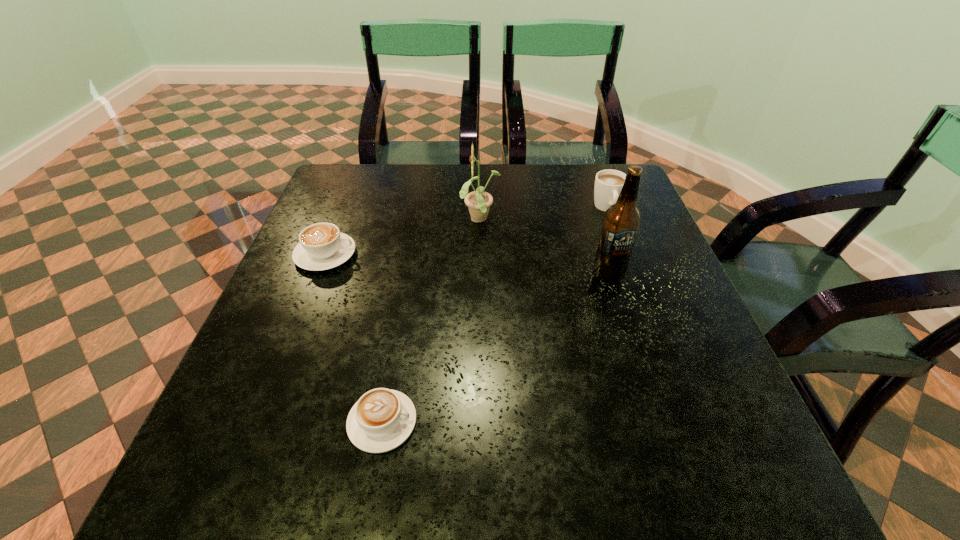
Identify the location of vacant point located on the front-facing side of the sunflower. This screenshot has width=960, height=540. (316, 220).

You are a GUI agent. You are given a task and a screenshot of the screen. Output one action in this format:
    pyautogui.click(x=<x>, y=<y>)
    Task: Click on the vacant region located on the front-facing side of the sunflower
    
    Given the screenshot: What is the action you would take?
    pyautogui.click(x=373, y=220)

This screenshot has width=960, height=540. What are the coordinates of `vacant space located 0.300m on the front-facing side of the sunflower` in the screenshot? It's located at (347, 220).

The width and height of the screenshot is (960, 540). Identify the location of free space located 0.200m with the handle on the side of the tallest cappuccino. (631, 271).

At what (x,y) coordinates should I click in order to perform the action: click on vacant space situated on the side of the leftmost object with the handle. Please return your answer as a coordinate pair (x, y). Looking at the image, I should click on (516, 254).

This screenshot has height=540, width=960. Identify the location of blank space located with the handle on the right side of the nearest cappuccino. (650, 422).

Find the location of a particular element. sunflower located at the far edge is located at coordinates (478, 202).

Find the location of `cappuccino that is at the far edge`. cappuccino that is at the far edge is located at coordinates tap(608, 183).

At what (x,y) coordinates should I click in order to perform the action: click on object that is at the near edge. Please return your answer as a coordinate pair (x, y). The width and height of the screenshot is (960, 540). Looking at the image, I should click on (382, 419).

At what (x,y) coordinates should I click in order to perform the action: click on object located in the left edge section of the desktop. Please return your answer as a coordinate pair (x, y). Looking at the image, I should click on (322, 246).